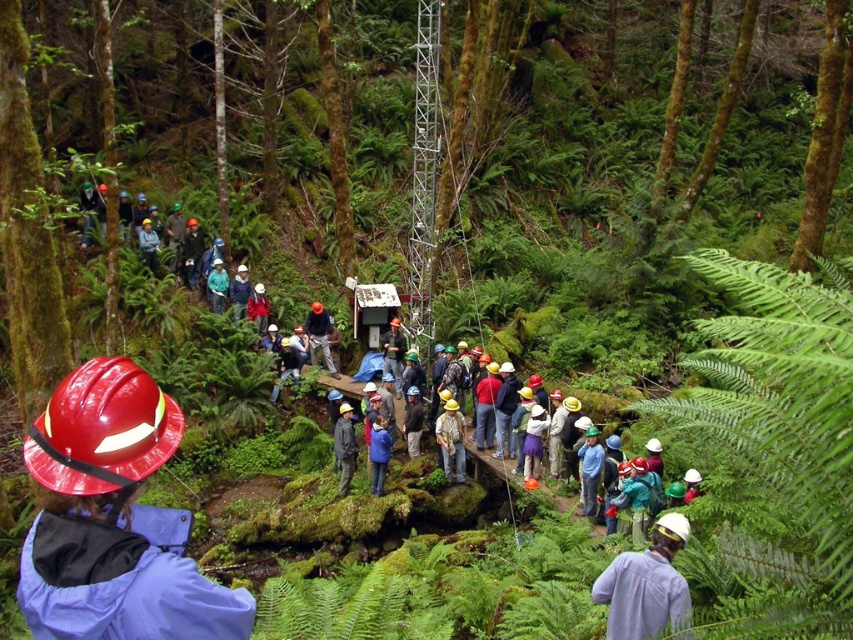
You are a hiker in the forest and see two people wearing the camouflage fabric shirt at center and the green matte jacket at center. Which person is standing closer to the ground?

The camouflage fabric shirt at center is below green matte jacket at center, so the person wearing the camouflage fabric shirt at center is standing closer to the ground.